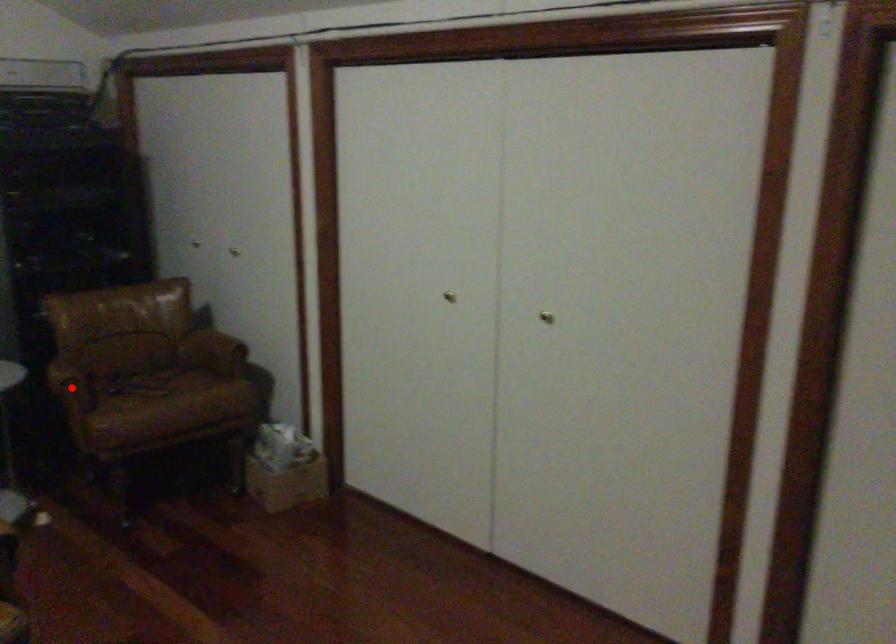
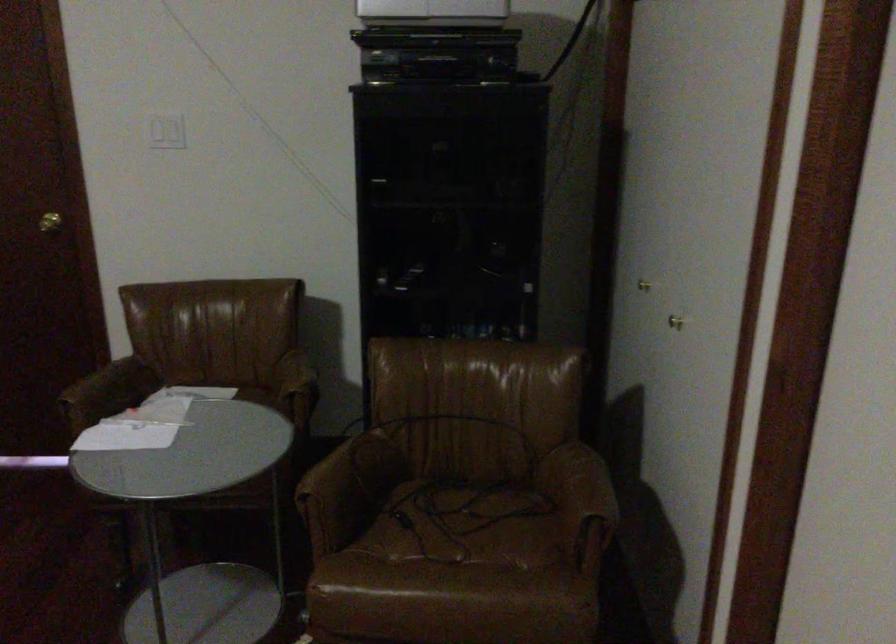
In the second image, find the point that corresponds to the highlighted location in the first image.

(312, 513)